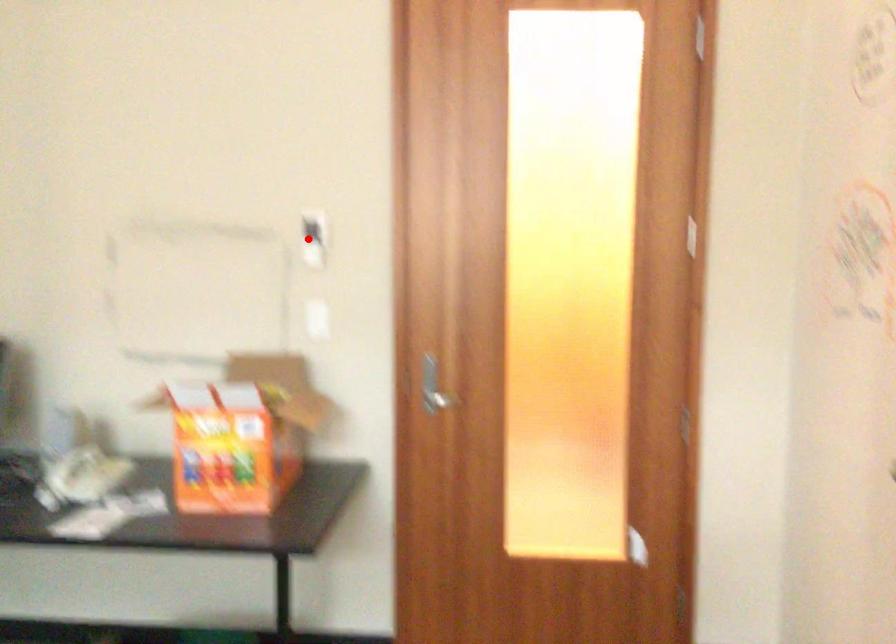
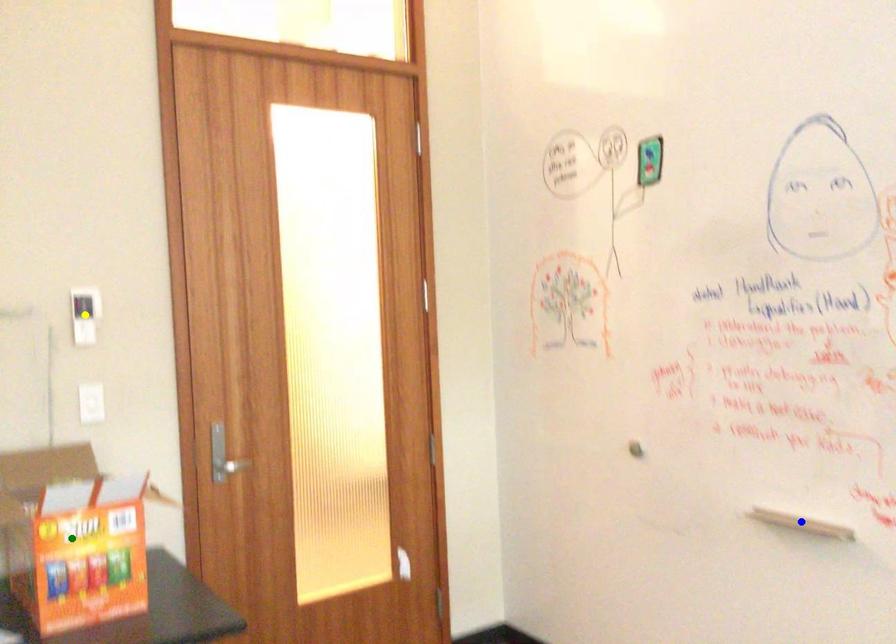
Question: I am providing you with two images of the same scene from different viewpoints. A red point is marked on the first image. You are given multiple points on the second image. Which mark in image 2 goes with the point in image 1?

Choices:
 (A) green point
 (B) blue point
 (C) yellow point

Answer: (C)